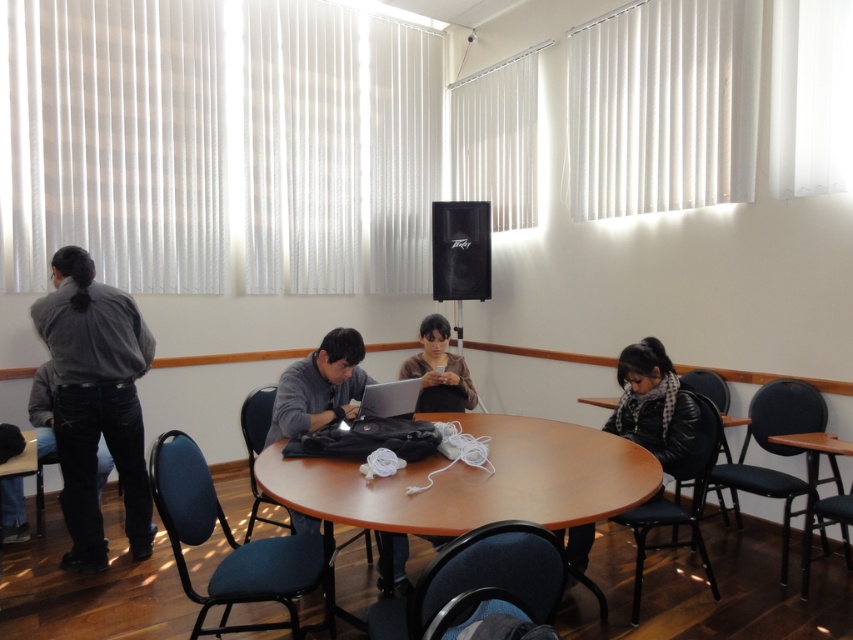
Does black matte speaker at upper center have a larger size compared to matte black shirt at center?

Actually, black matte speaker at upper center might be smaller than matte black shirt at center.

Is point (482, 246) positioned in front of point (445, 401)?

No, it is not.

This screenshot has height=640, width=853. Identify the location of black matte speaker at upper center. (460, 250).

Is point (680, 408) in front of point (421, 378)?

Yes, it is.

Who is more forward, (680, 458) or (370, 384)?

Positioned in front is point (680, 458).

Describe the element at coordinates (653, 403) in the screenshot. The width and height of the screenshot is (853, 640). I see `black leather jacket at lower right` at that location.

Image resolution: width=853 pixels, height=640 pixels. Find the location of `black leather jacket at lower right`. black leather jacket at lower right is located at coordinates (653, 403).

Which is above, black matte speaker at upper center or wooden table at center?

black matte speaker at upper center is above.

Who is taller, black matte speaker at upper center or wooden table at center?

black matte speaker at upper center is taller.

Locate an element on the screen. The width and height of the screenshot is (853, 640). black matte speaker at upper center is located at coordinates (460, 250).